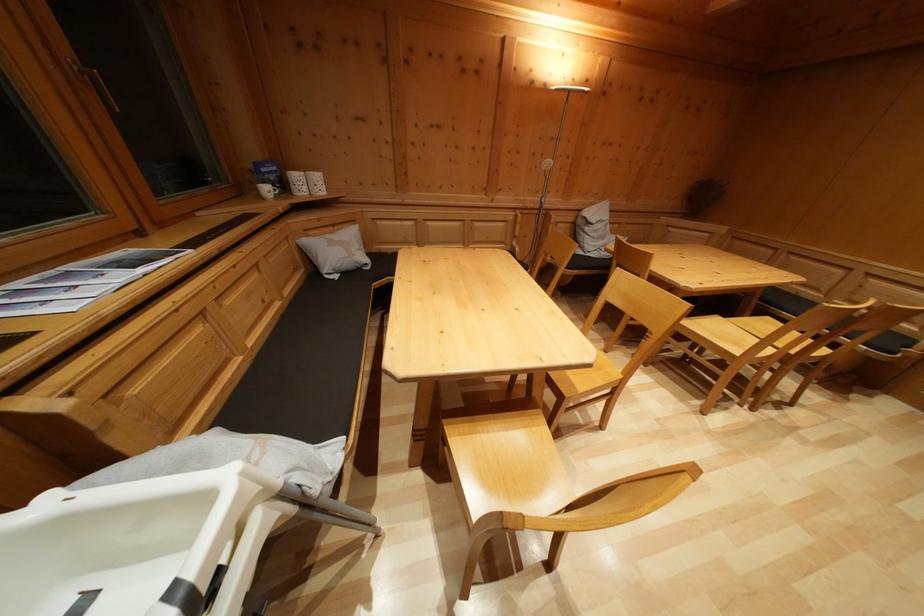
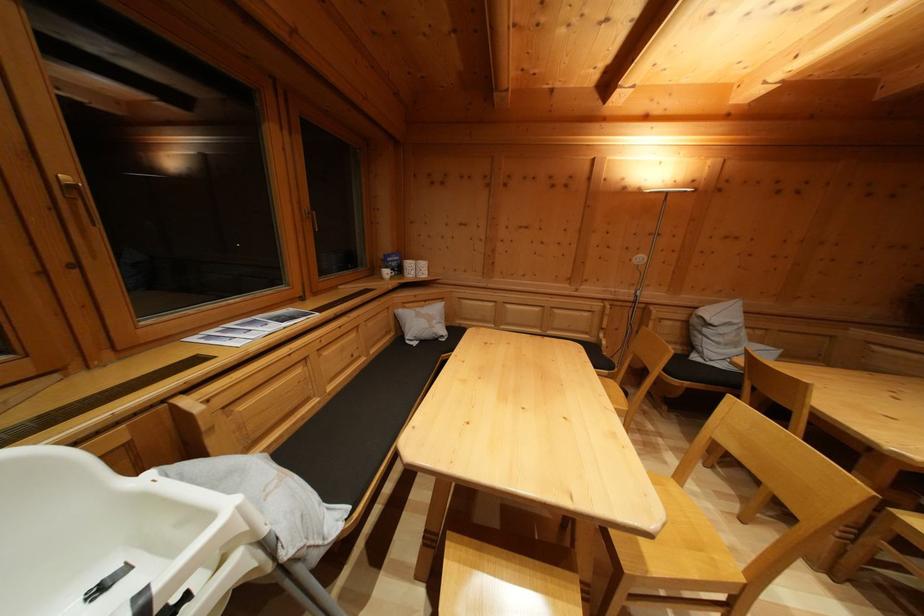
The point at (338, 233) is marked in the first image. Where is the corresponding point in the second image?

(431, 308)